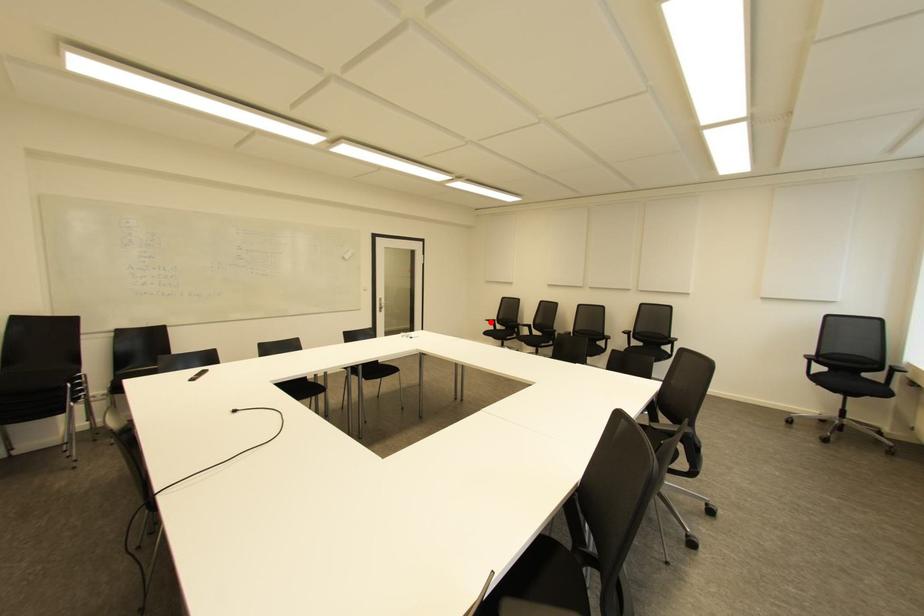
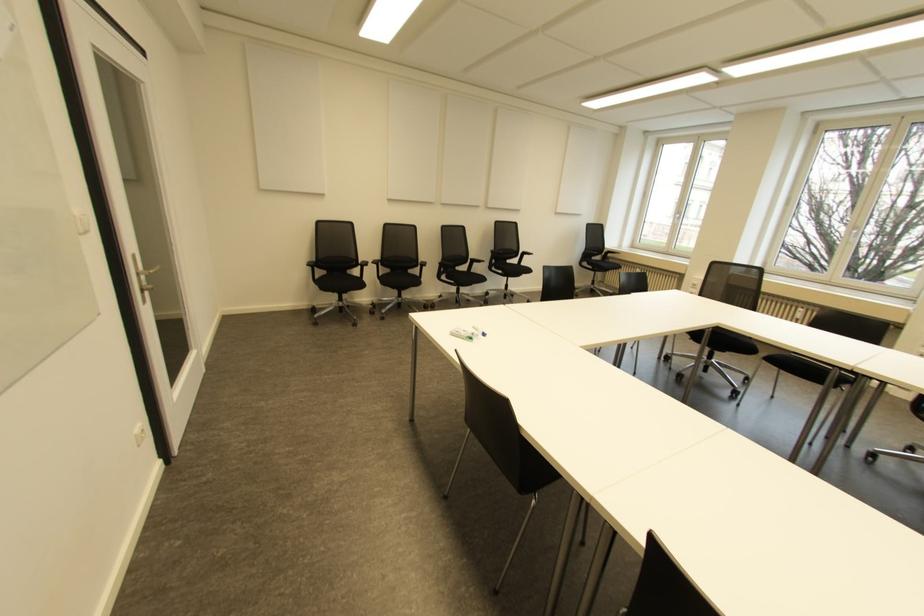
Question: I am providing you with two images of the same scene from different viewpoints. A red point is shown in image1. For the corresponding object point in image2, is it positioned nearer or farther from the camera?

Choices:
 (A) Nearer
 (B) Farther

Answer: (A)